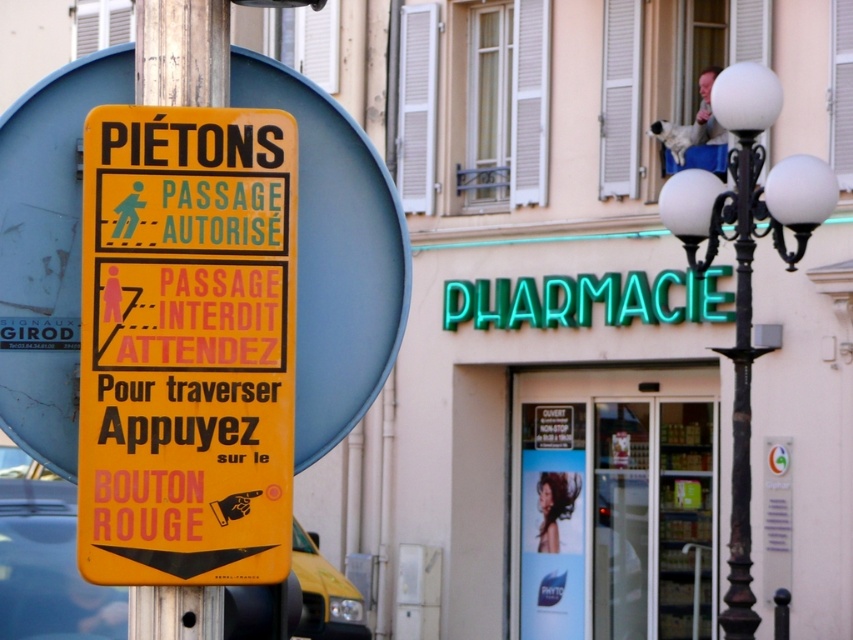
Which is in front, point (225, 264) or point (527, 436)?

Point (225, 264)

The image size is (853, 640). In order to click on yellow plastic sign at left in this screenshot , I will do `click(186, 346)`.

Between point (39, 371) and point (547, 464), which one is positioned behind?

The point (547, 464) is more distant.

Between point (405, 284) and point (680, 401), which one is positioned behind?

The point (680, 401) is more distant.

The width and height of the screenshot is (853, 640). I want to click on yellow matte sign at left, so click(x=335, y=256).

Is yellow plastic car at lower left above metallic pole at left?

No, yellow plastic car at lower left is not above metallic pole at left.

Is yellow plastic car at lower left smaller than metallic pole at left?

Yes.

Between point (112, 628) and point (215, 36), which one is positioned in front?

Point (215, 36) is in front.

Find the location of a particular element. The width and height of the screenshot is (853, 640). yellow plastic car at lower left is located at coordinates (48, 568).